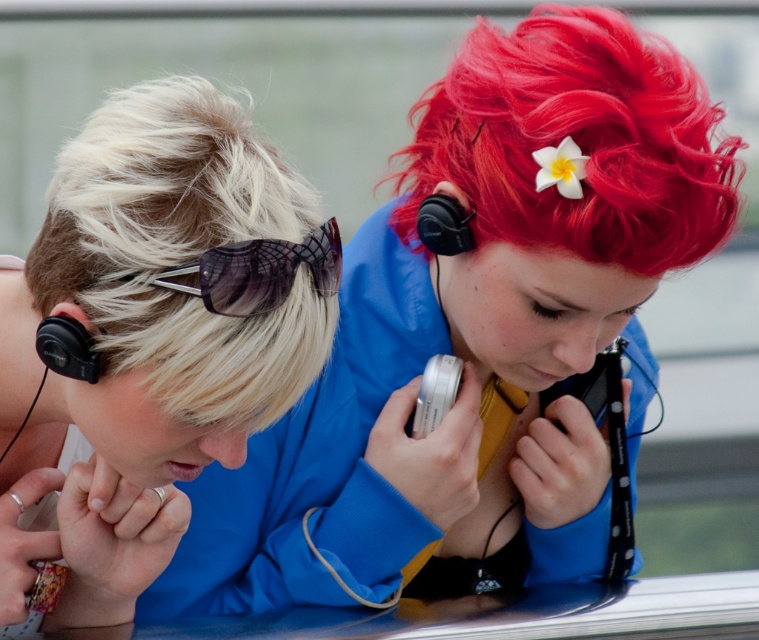
You are a photographer trying to capture the perfect shot of the two people in the image. You notice a specific point in the scene marked at coordinates point (x=180, y=250). What object is located at this point?

The point (x=180, y=250) is where the blonde hair at left is located.

You are a photographer trying to position your equipment precisely in a scene. You need to place a new object at the exact coordinates where the transparent plastic goggles at upper left are located. What are the coordinates you should use?

The coordinates for the transparent plastic goggles at upper left are 0.425 in the x direction and 0.341 in the y direction.

You are a photographer trying to capture the two people in the scene. The blonde hair at left and the black matte earphone at left are in your viewfinder. According to the scene description, which object is positioned more to the right?

The blonde hair at left is positioned more to the right than the black matte earphone at left.